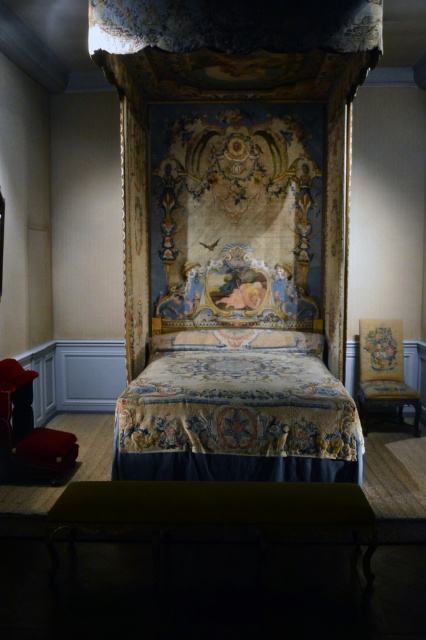
You are standing in the antique bedroom and want to place a small decorative vase on the closest object to you. Which object should you choose between the embroidered fabric bed at center and the gold fabric chair at right?

The gold fabric chair at right is closer to you than the embroidered fabric bed at center, so you should place the vase on the gold fabric chair at right.

You are standing in the antique bedroom and want to place a small decorative item. You have two options for placement based on coordinates given in the scene. The first option is at point (284, 388) and the second option is at point (296, 336). Which point is closer to you, the observer?

Point (284, 388) is in front of point (296, 336), so it is closer to you as the observer.